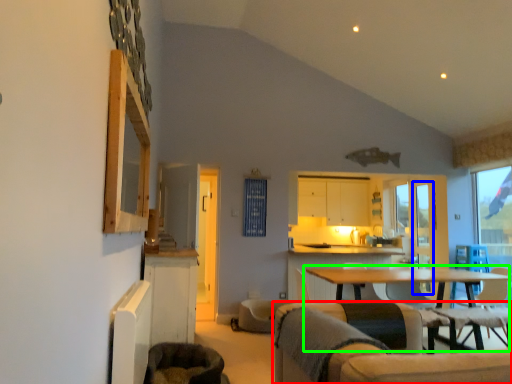
Question: Based on their relative distances, which object is nearer to chair (highlighted by a red box)? Choose from screen door (highlighted by a blue box) and table (highlighted by a green box).

Choices:
 (A) screen door
 (B) table

Answer: (B)